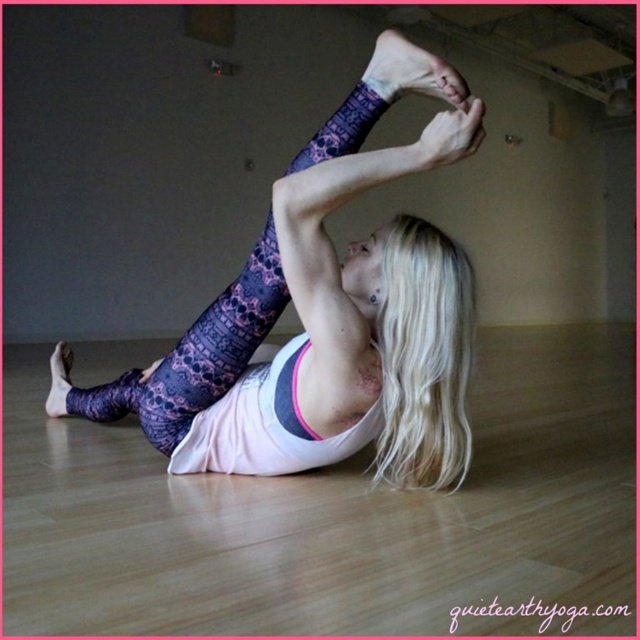
Does purple printed leggings at center have a lesser width compared to purple printed sock at lower left?

Incorrect, purple printed leggings at center's width is not less than purple printed sock at lower left's.

Which of these two, purple printed leggings at center or purple printed sock at lower left, stands shorter?

purple printed sock at lower left

Find the location of a particular element. Image resolution: width=640 pixels, height=640 pixels. purple printed leggings at center is located at coordinates (337, 314).